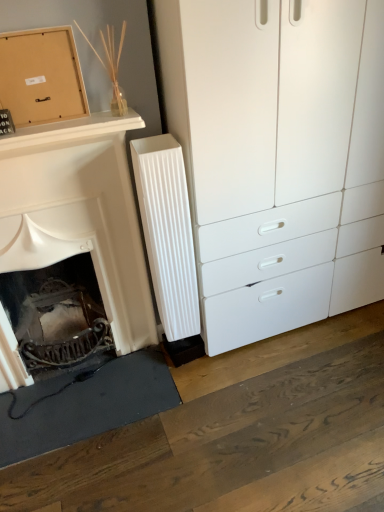
Image resolution: width=384 pixels, height=512 pixels. What are the coordinates of `spots to the right of matte cardboard box at upper left` in the screenshot? It's located at (76, 119).